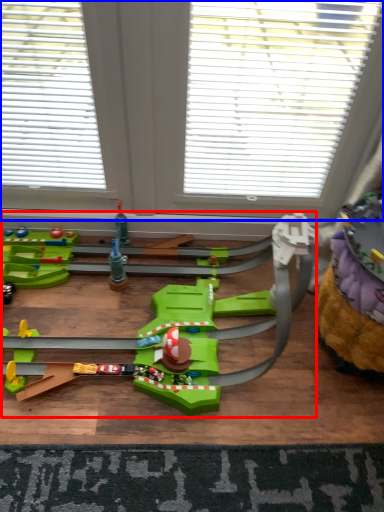
Question: Which object appears farthest to the camera in this image, toy (highlighted by a red box) or window (highlighted by a blue box)?

Choices:
 (A) toy
 (B) window

Answer: (B)